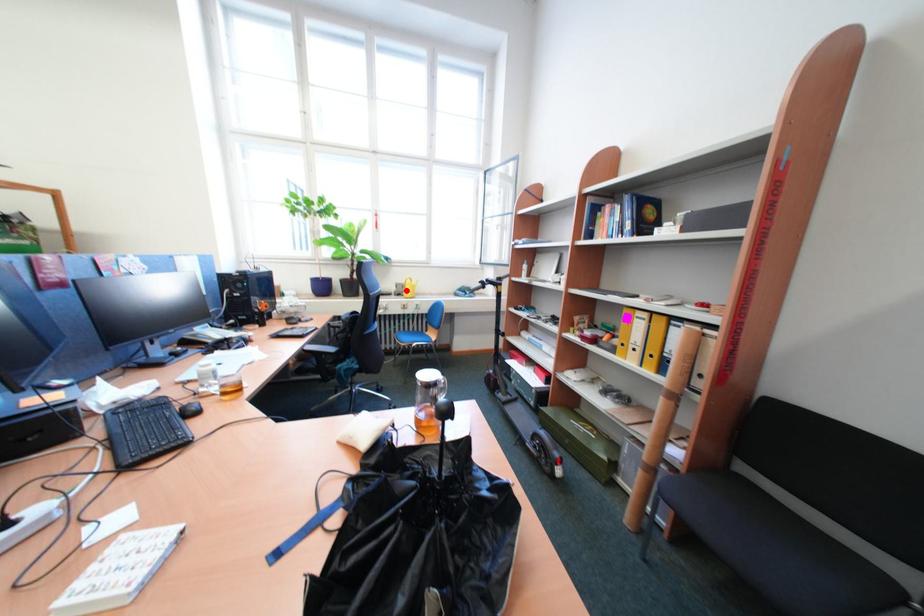
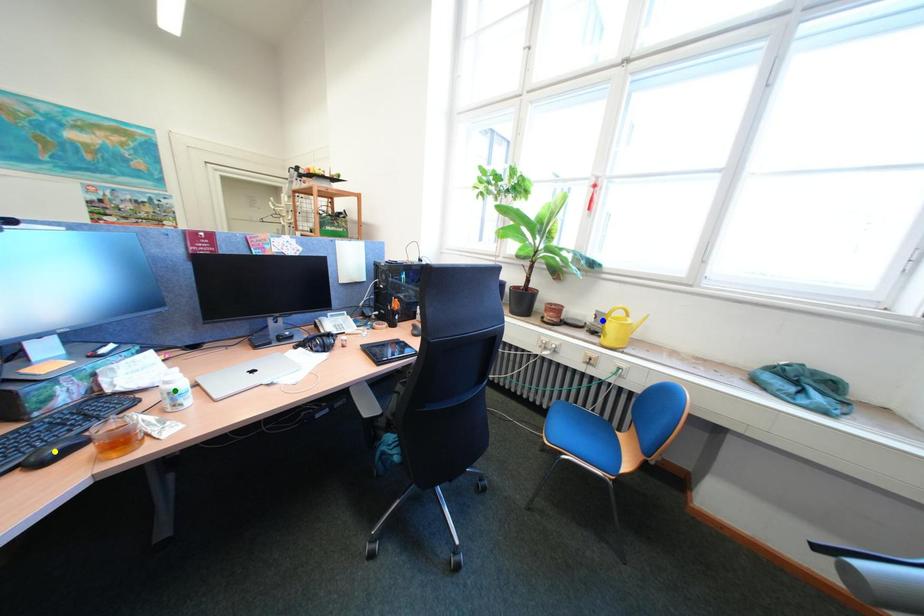
Question: I am providing you with two images of the same scene from different viewpoints. A red point is marked on the first image. You are given multiple points on the second image. Which spot in image 2 lines up with the point in image 1?

Choices:
 (A) green point
 (B) yellow point
 (C) blue point

Answer: (C)